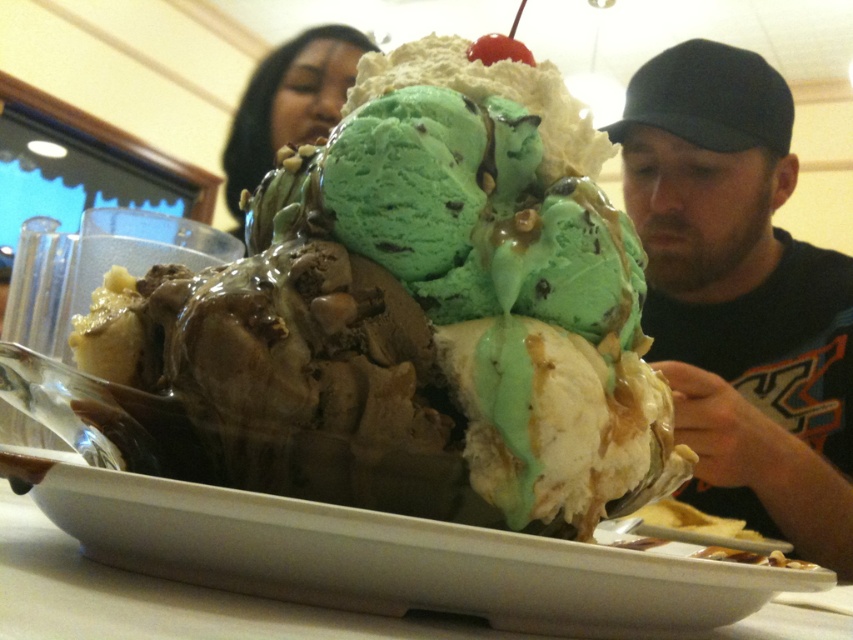
Question: Does chocolate ice cream at center appear on the left side of dark blue cap at right?

Choices:
 (A) yes
 (B) no

Answer: (A)

Question: Which object appears farthest from the camera in this image?

Choices:
 (A) chocolate ice cream at center
 (B) black hair at upper center
 (C) dark blue cap at right

Answer: (B)

Question: Observing the image, what is the correct spatial positioning of chocolate ice cream at center in reference to dark blue cap at right?

Choices:
 (A) below
 (B) above

Answer: (A)

Question: Which of the following is the farthest from the observer?

Choices:
 (A) (312, 115)
 (B) (125, 385)
 (C) (751, 61)

Answer: (A)

Question: Is chocolate ice cream at center above black hair at upper center?

Choices:
 (A) yes
 (B) no

Answer: (B)

Question: Among these objects, which one is farthest from the camera?

Choices:
 (A) chocolate ice cream at center
 (B) dark blue cap at right
 (C) black hair at upper center

Answer: (C)